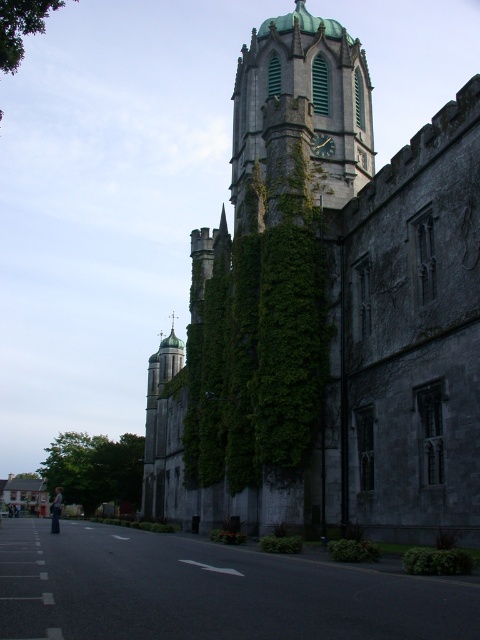
You are an architect assessing the proportions of the building. Based on the image, which object is taller between the green stone clock tower at upper center and the green leafy tree at lower left?

The green stone clock tower at upper center is much taller than the green leafy tree at lower left according to the description.

You are standing at the base of the green stone clock tower at upper center, and you want to take a photo of it from a distance where it will appear smaller in the frame. If you walk 30 meters away from the tower, will it still be visible in the photo?

The green stone clock tower at upper center is currently 65.25 meters from the camera. If you walk an additional 30 meters away, the total distance becomes 95.25 meters. Since the tower is still within the camera frame, it will still be visible, though smaller.